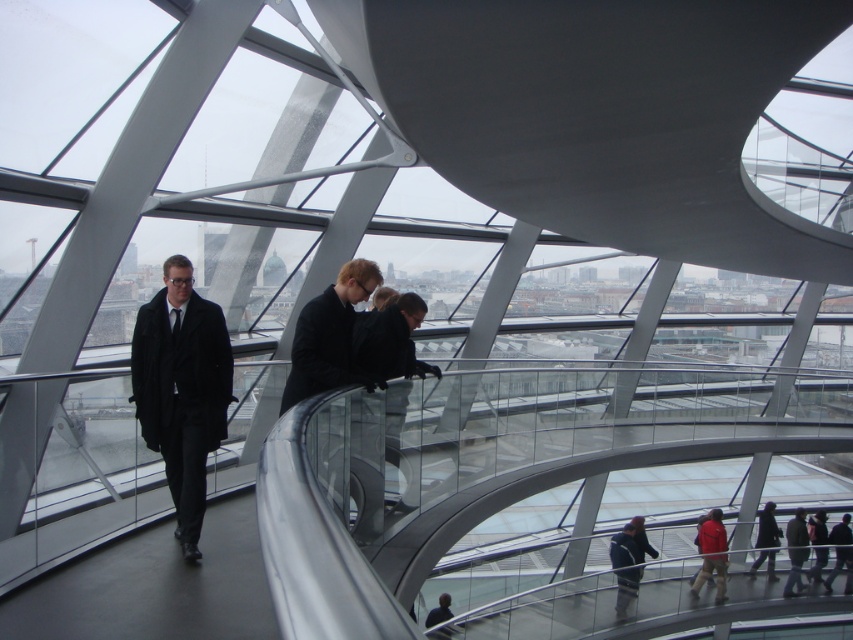
You are a photographer trying to capture a group photo of the matte black coat at left and the black matte suit at center. If you want to ensure both subjects are fully visible in the frame without cropping, which subject requires more space horizontally?

The matte black coat at left requires more horizontal space because its width is larger than the black matte suit at center.

You are a photographer standing at the center of the glass dome and want to take a photo of the matte black coat at left and the black matte suit at center. Which object is closer to the left side of your camera frame?

The matte black coat at left is positioned on the left side of black matte suit at center, so the matte black coat at left is closer to the left side of your camera frame.

You are standing in the modern architectural structure with a city view. You see a matte black coat at left and a matte black jacket at lower right. Which one is positioned more to the left?

The matte black coat at left is positioned more to the left than the matte black jacket at lower right.